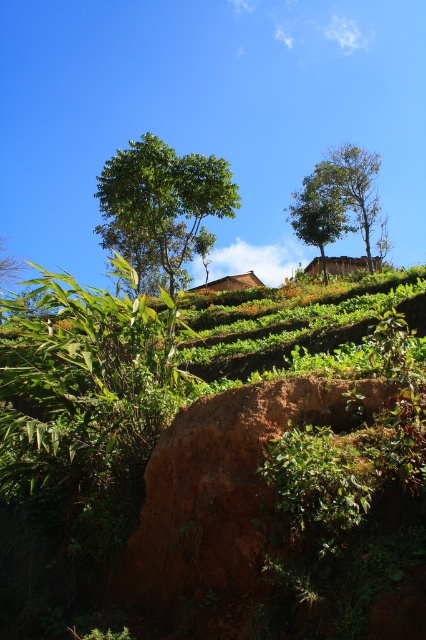
Question: Does green leafy tree at upper left appear on the left side of green leafy tree at upper center?

Choices:
 (A) yes
 (B) no

Answer: (A)

Question: Which object appears farthest from the camera in this image?

Choices:
 (A) green leafy tree at upper center
 (B) green leafy tree at upper left

Answer: (A)

Question: Can you confirm if green leafy tree at upper left is positioned below green leafy tree at upper center?

Choices:
 (A) no
 (B) yes

Answer: (B)

Question: Among these objects, which one is nearest to the camera?

Choices:
 (A) green leafy tree at upper left
 (B) green leafy tree at upper center

Answer: (A)

Question: Can you confirm if green leafy tree at upper left is smaller than green leafy tree at upper center?

Choices:
 (A) yes
 (B) no

Answer: (A)